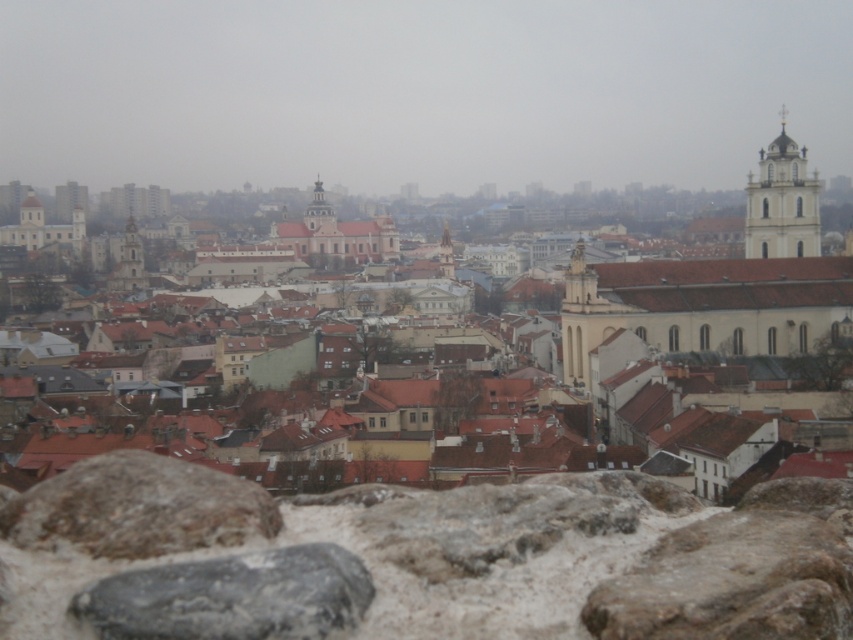
Does brown tiled roofs at center have a greater height compared to gray rough stone at lower left?

Yes.

Identify the location of brown tiled roofs at center. (637, 429).

Between point (672, 387) and point (315, 618), which one is positioned in front?

Point (315, 618) is in front.

Locate an element on the screen. This screenshot has height=640, width=853. brown tiled roofs at center is located at coordinates (637, 429).

Can you confirm if white smooth tower at upper right is shorter than smooth stone tower at center?

No, white smooth tower at upper right is not shorter than smooth stone tower at center.

From the picture: Measure the distance between white smooth tower at upper right and camera.

A distance of 701.09 feet exists between white smooth tower at upper right and camera.

Describe the element at coordinates (782, 202) in the screenshot. Image resolution: width=853 pixels, height=640 pixels. I see `white smooth tower at upper right` at that location.

What are the coordinates of `white smooth tower at upper right` in the screenshot? It's located at (782, 202).

Does gray rough stone at lower left have a smaller size compared to smooth stone tower at center?

Yes.

Can you confirm if gray rough stone at lower left is bigger than smooth stone tower at center?

No, gray rough stone at lower left is not bigger than smooth stone tower at center.

Who is more forward, (117,586) or (561,321)?

Point (117,586)

Where is `gray rough stone at lower left`? gray rough stone at lower left is located at coordinates (233, 596).